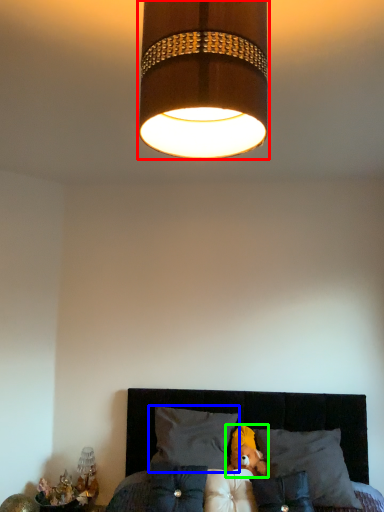
Question: Which object is the farthest from lamp (highlighted by a red box)? Choose among these: pillow (highlighted by a blue box) or teddy (highlighted by a green box).

Choices:
 (A) pillow
 (B) teddy

Answer: (B)